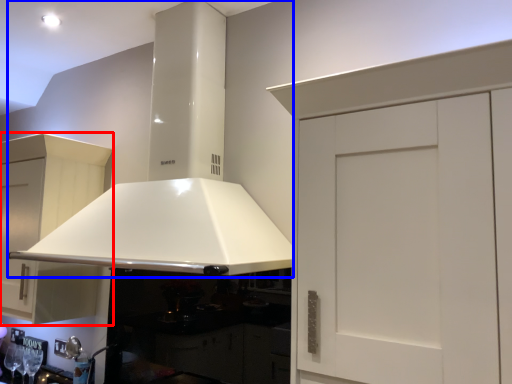
Question: Among these objects, which one is nearest to the camera, cabinetry (highlighted by a red box) or exhaust hood (highlighted by a blue box)?

Choices:
 (A) cabinetry
 (B) exhaust hood

Answer: (B)